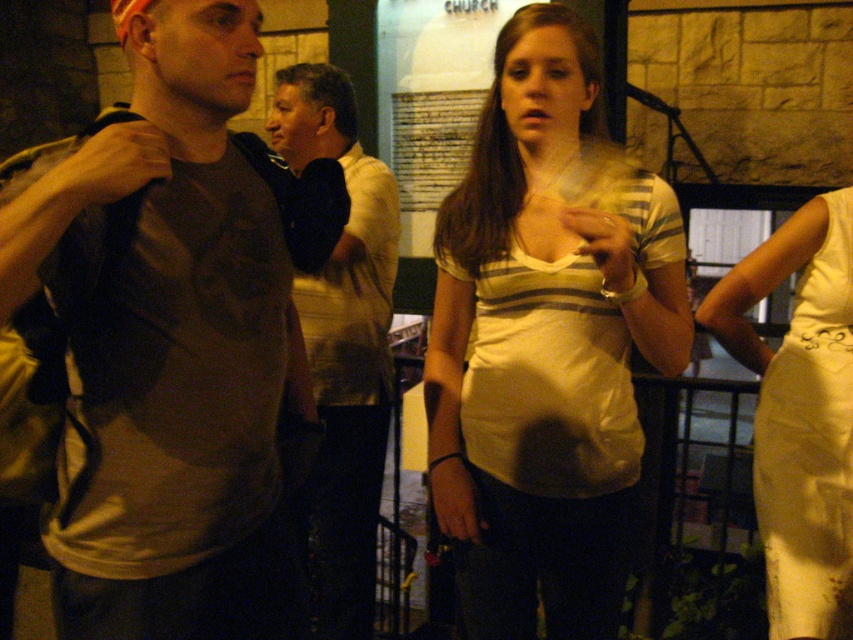
Which of these two, white satin dress at right or light brown shirt at center, stands shorter?

With less height is white satin dress at right.

Looking at this image, can you confirm if white satin dress at right is wider than light brown shirt at center?

No, white satin dress at right is not wider than light brown shirt at center.

Which is behind, point (785, 385) or point (288, 141)?

Positioned behind is point (288, 141).

Where is `white satin dress at right`? This screenshot has height=640, width=853. white satin dress at right is located at coordinates (799, 413).

Is matte striped shirt at center wider than light brown shirt at center?

Indeed, matte striped shirt at center has a greater width compared to light brown shirt at center.

Does matte striped shirt at center lie in front of light brown shirt at center?

Yes, it is in front of light brown shirt at center.

Who is more distant from viewer, (440, 298) or (281, 80)?

The point (281, 80) is behind.

Where is `matte striped shirt at center`? The height and width of the screenshot is (640, 853). matte striped shirt at center is located at coordinates click(x=544, y=346).

Does matte brown t-shirt at left have a greater height compared to white satin dress at right?

Yes, matte brown t-shirt at left is taller than white satin dress at right.

Is the position of matte brown t-shirt at left less distant than that of white satin dress at right?

Yes, it is.

Image resolution: width=853 pixels, height=640 pixels. I want to click on matte brown t-shirt at left, so click(167, 333).